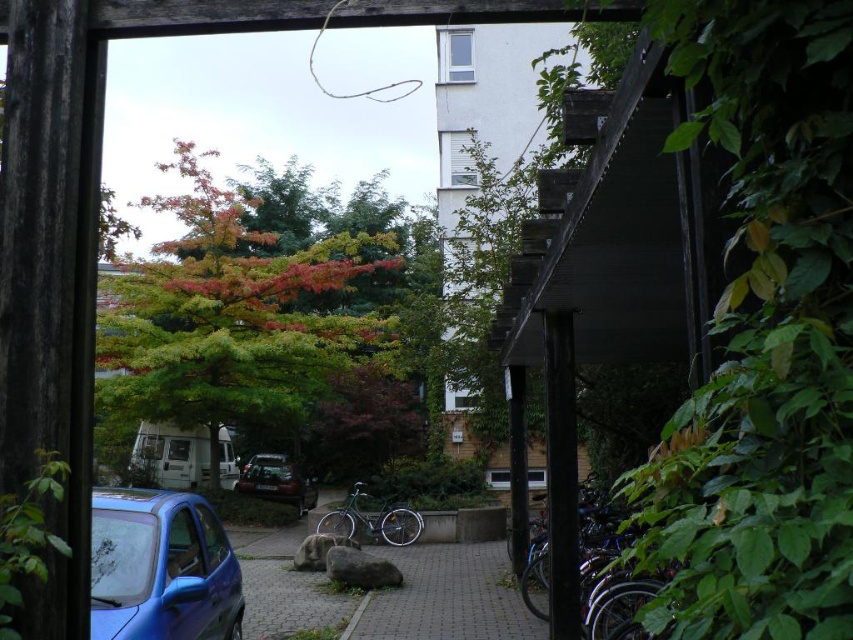
Question: Based on their relative distances, which object is farther from the multicolored foliage at center?

Choices:
 (A) shiny metallic bicycle at center
 (B) shiny metallic bicycle at lower right
 (C) brick paved driveway at center
 (D) shiny dark gray car at center

Answer: (B)

Question: Is shiny blue car at lower left closer to the viewer compared to shiny metallic bicycle at center?

Choices:
 (A) yes
 (B) no

Answer: (A)

Question: Can you confirm if brick paved driveway at center is positioned below shiny metallic bicycle at center?

Choices:
 (A) no
 (B) yes

Answer: (B)

Question: Which point is closer to the camera?

Choices:
 (A) (614, 602)
 (B) (157, 211)

Answer: (A)

Question: Does shiny blue car at lower left have a lesser width compared to brick paved driveway at center?

Choices:
 (A) yes
 (B) no

Answer: (B)

Question: Estimate the real-world distances between objects in this image. Which object is closer to the shiny metallic bicycle at center?

Choices:
 (A) brick paved driveway at center
 (B) shiny blue car at lower left
 (C) shiny metallic bicycle at lower right

Answer: (A)